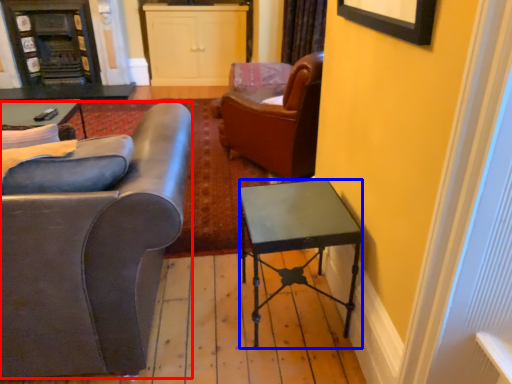
Question: Which object is closer to the camera taking this photo, chair (highlighted by a red box) or desk (highlighted by a blue box)?

Choices:
 (A) chair
 (B) desk

Answer: (A)